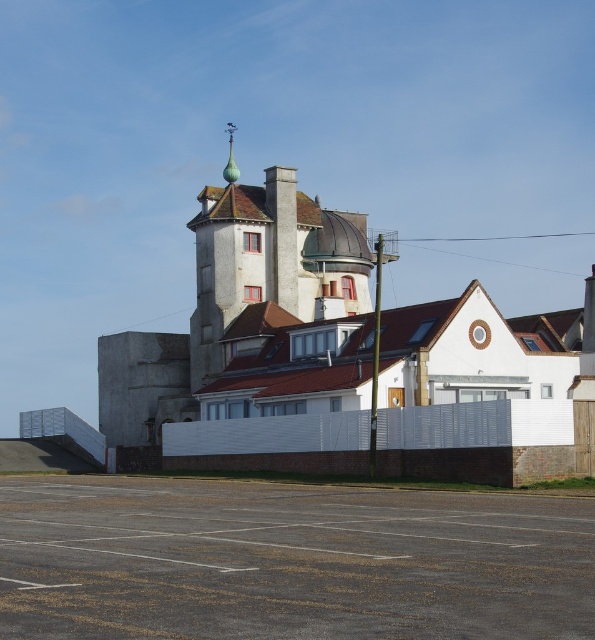
You are a delivery driver who needs to park your truck in the gray asphalt parking lot at lower center. The truck requires a space that is at least as large as the green glazed tile spire at upper center. Can you fit your truck in the parking lot?

The gray asphalt parking lot at lower center has a smaller size compared to the green glazed tile spire at upper center. Therefore, the parking lot is not large enough to accommodate the truck, which needs a space at least as big as the spire.

You are a delivery driver who needs to park your truck in the gray asphalt parking lot at lower center. Your truck is 15 feet long. The green glazed tile spire at upper center is directly above the parking lot. Is there enough space between the parking lot and the spire for your truck to park without hitting the spire?

The distance between the gray asphalt parking lot at lower center and the green glazed tile spire at upper center is 261.35 feet. Since your truck is only 15 feet long, there is ample space to park without hitting the spire.